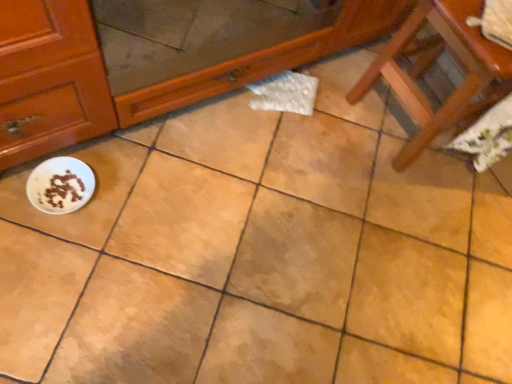
In order to click on vacant space in front of wooden chair at lower right in this screenshot , I will do `click(384, 198)`.